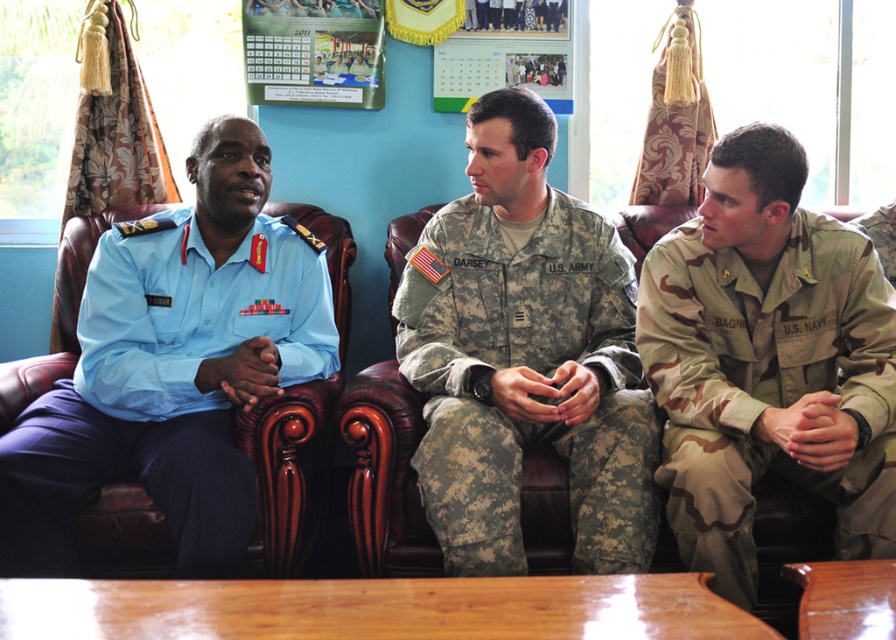
Does brown leather couch at center come behind camouflage fabric us navy uniform at right?

Yes.

Which is more to the right, brown leather couch at center or camouflage fabric us navy uniform at right?

From the viewer's perspective, camouflage fabric us navy uniform at right appears more on the right side.

Is point (371, 545) behind point (854, 388)?

Yes, it is.

At what (x,y) coordinates should I click in order to perform the action: click on brown leather couch at center. Please return your answer as a coordinate pair (x, y). This screenshot has height=640, width=896. Looking at the image, I should click on (340, 480).

Is point (222, 454) farther from camera compared to point (409, 276)?

No, it is in front of (409, 276).

Is light blue uniform at left below camouflage fabric us army uniform at center?

No.

Is point (205, 385) positioned in front of point (630, 413)?

No, it is not.

Locate an element on the screen. Image resolution: width=896 pixels, height=640 pixels. light blue uniform at left is located at coordinates (x=173, y=368).

Is light blue uniform at left smaller than brown leather couch at center?

Correct, light blue uniform at left occupies less space than brown leather couch at center.

Does light blue uniform at left appear under brown leather couch at center?

Actually, light blue uniform at left is above brown leather couch at center.

This screenshot has height=640, width=896. I want to click on light blue uniform at left, so click(173, 368).

Locate an element on the screen. light blue uniform at left is located at coordinates (173, 368).